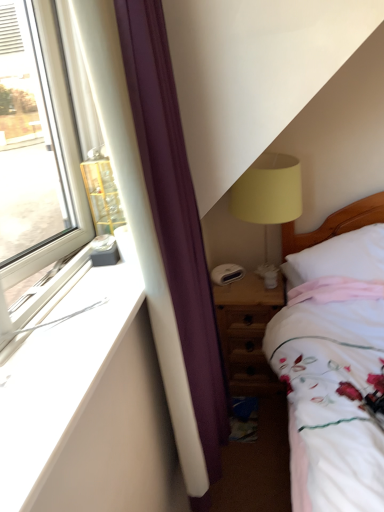
This screenshot has height=512, width=384. Find the location of `free point below matte yellow fabric lampshade at upper right (from a real-world perspective)`. free point below matte yellow fabric lampshade at upper right (from a real-world perspective) is located at coordinates (263, 278).